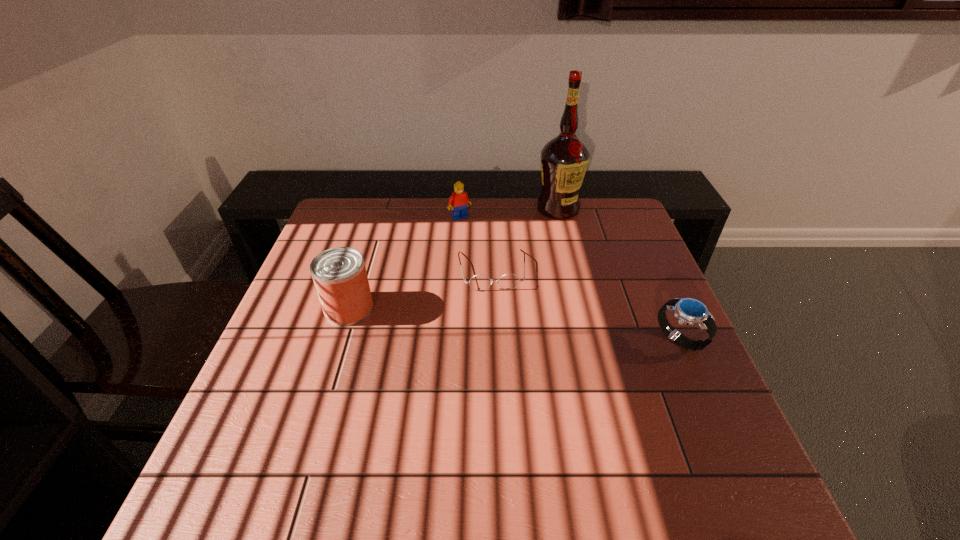
Image resolution: width=960 pixels, height=540 pixels. Find the location of `empty space between the spectacles and the rightmost object`. empty space between the spectacles and the rightmost object is located at coordinates (586, 305).

This screenshot has width=960, height=540. I want to click on free space between the fourth tallest object and the fourth object from left to right, so click(618, 274).

This screenshot has width=960, height=540. Identify the location of object that is the closest to the alcohol. (509, 281).

The height and width of the screenshot is (540, 960). Identify the location of object that stands as the second closest to the third tallest object. (564, 160).